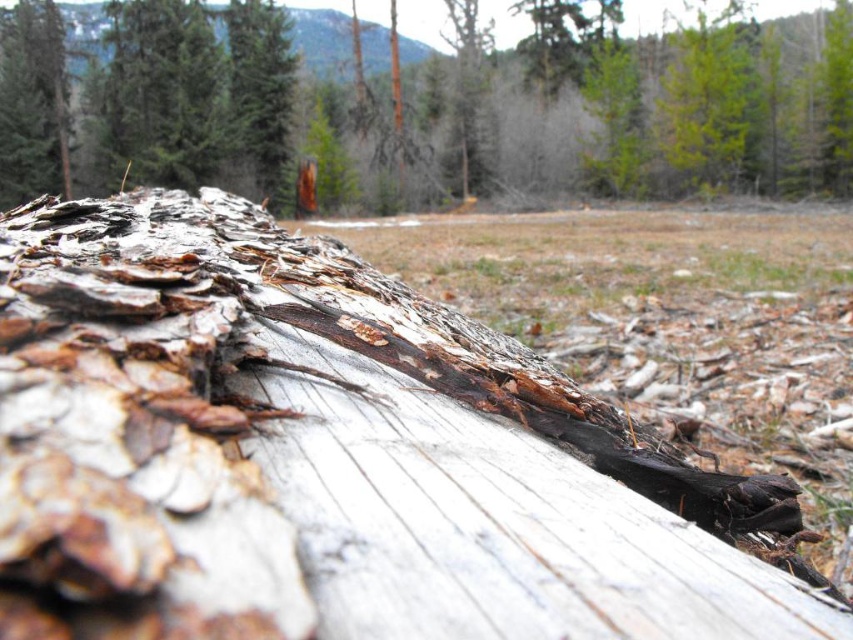
Between point (181, 502) and point (517, 200), which one is positioned behind?

The point (517, 200) is more distant.

Between point (90, 508) and point (544, 19), which one is positioned behind?

Point (544, 19)

This screenshot has width=853, height=640. Find the location of `weathered wood at center`. weathered wood at center is located at coordinates (332, 456).